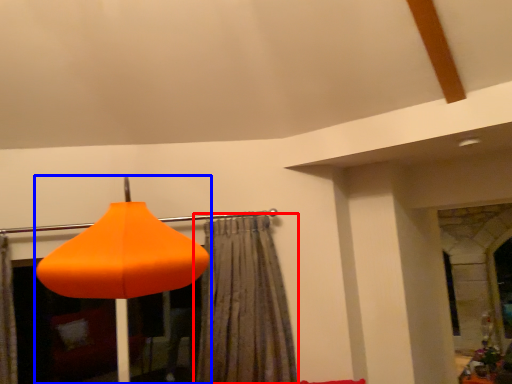
Question: Which of the following is the farthest to the observer, curtain (highlighted by a red box) or lamp (highlighted by a blue box)?

Choices:
 (A) curtain
 (B) lamp

Answer: (A)